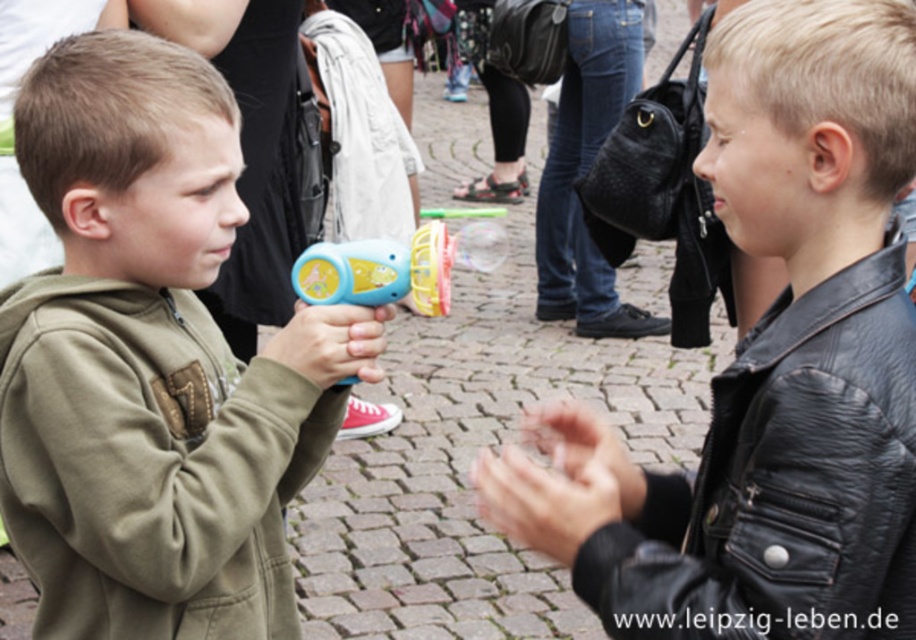
Is point (662, 584) positioned before point (290, 278)?

Yes, it is in front of point (290, 278).

Which of these two, black leather jacket at right or matte plastic bubble gun at left, stands taller?

Standing taller between the two is black leather jacket at right.

The width and height of the screenshot is (916, 640). Identify the location of black leather jacket at right. (784, 484).

Who is more forward, (325, 278) or (410, 253)?

Point (325, 278) is in front.

Does matte plastic bubble gun at left have a smaller size compared to translucent plastic bubble gun at center?

Actually, matte plastic bubble gun at left might be larger than translucent plastic bubble gun at center.

Does point (406, 294) come closer to viewer compared to point (440, 296)?

No, it is behind (440, 296).

Where is `matte plastic bubble gun at left`? matte plastic bubble gun at left is located at coordinates (352, 273).

Is matte blue toy gun at left to the right of translucent plastic bubble gun at center from the viewer's perspective?

No, matte blue toy gun at left is not to the right of translucent plastic bubble gun at center.

Is matte blue toy gun at left below translucent plastic bubble gun at center?

Correct, matte blue toy gun at left is located below translucent plastic bubble gun at center.

The image size is (916, 640). I want to click on matte blue toy gun at left, so click(x=151, y=362).

Locate an element on the screen. The width and height of the screenshot is (916, 640). matte blue toy gun at left is located at coordinates click(x=151, y=362).